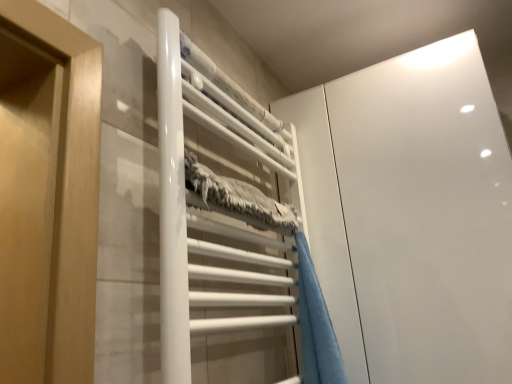
Question: Does white glossy cabinet at upper right have a larger size compared to white glossy towel rack at center?

Choices:
 (A) yes
 (B) no

Answer: (A)

Question: From the image's perspective, is white glossy cabinet at upper right beneath white glossy towel rack at center?

Choices:
 (A) yes
 (B) no

Answer: (A)

Question: Can you confirm if white glossy cabinet at upper right is taller than white glossy towel rack at center?

Choices:
 (A) no
 (B) yes

Answer: (B)

Question: From the image's perspective, is white glossy cabinet at upper right on top of white glossy towel rack at center?

Choices:
 (A) yes
 (B) no

Answer: (B)

Question: Is white glossy cabinet at upper right beside white glossy towel rack at center?

Choices:
 (A) no
 (B) yes

Answer: (A)

Question: Could you tell me if white glossy cabinet at upper right is facing white glossy towel rack at center?

Choices:
 (A) yes
 (B) no

Answer: (A)

Question: Is blue plush towel at center at the right side of white glossy cabinet at upper right?

Choices:
 (A) yes
 (B) no

Answer: (B)

Question: From a real-world perspective, is blue plush towel at center on top of white glossy cabinet at upper right?

Choices:
 (A) yes
 (B) no

Answer: (B)

Question: From a real-world perspective, is blue plush towel at center positioned under white glossy cabinet at upper right based on gravity?

Choices:
 (A) yes
 (B) no

Answer: (A)

Question: From the image's perspective, is blue plush towel at center above white glossy cabinet at upper right?

Choices:
 (A) no
 (B) yes

Answer: (A)

Question: Is blue plush towel at center wider than white glossy cabinet at upper right?

Choices:
 (A) no
 (B) yes

Answer: (A)

Question: Is blue plush towel at center bigger than white glossy cabinet at upper right?

Choices:
 (A) yes
 (B) no

Answer: (B)

Question: Is white glossy towel rack at center bigger than blue plush towel at center?

Choices:
 (A) no
 (B) yes

Answer: (B)